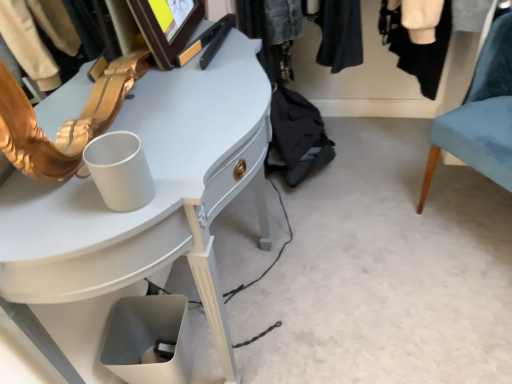
Identify the location of free space to the left of velvet teal chair at right. (381, 246).